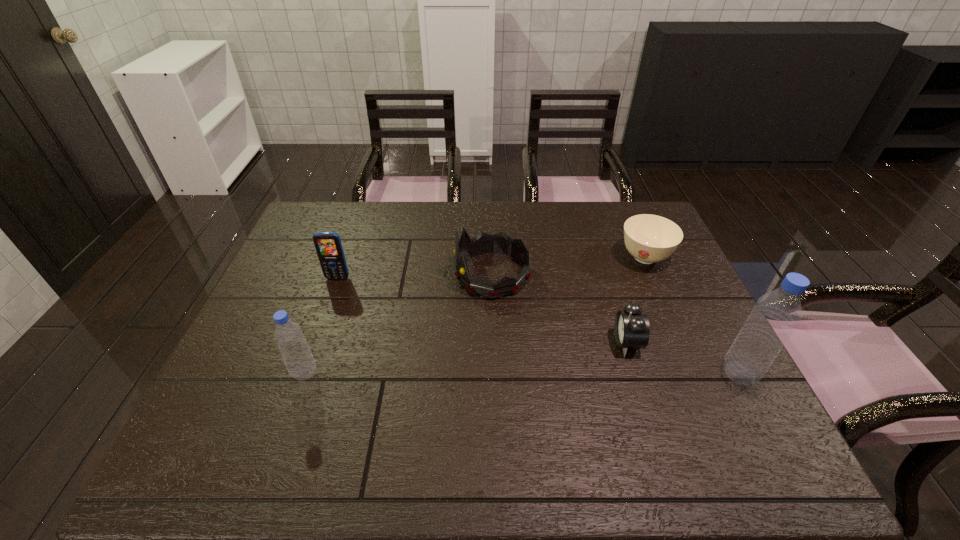
I want to click on the left bottle, so (x=300, y=363).

Where is `the shorter bottle`? the shorter bottle is located at coordinates (300, 363).

The width and height of the screenshot is (960, 540). I want to click on the tallest object, so click(776, 314).

Where is `the right bottle`? This screenshot has width=960, height=540. the right bottle is located at coordinates (776, 314).

Where is `tiara`? tiara is located at coordinates (483, 243).

Where is `cellular telephone`? cellular telephone is located at coordinates (328, 245).

The height and width of the screenshot is (540, 960). In order to click on sugar bowl in this screenshot , I will do `click(648, 238)`.

This screenshot has width=960, height=540. Find the location of `alarm clock`. alarm clock is located at coordinates (632, 330).

Locate an element on the screen. The image size is (960, 540). vacant space located 0.150m on the right of the shorter bottle is located at coordinates (381, 373).

What are the coordinates of `free location located 0.290m on the left of the tallest object` in the screenshot? It's located at (599, 373).